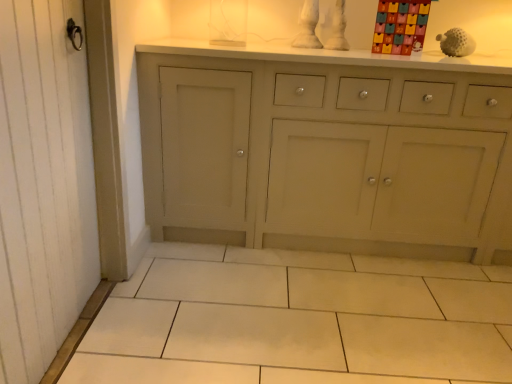
Question: From a real-world perspective, does white matte golf ball at upper right, acting as the 2th toy starting from the left, stand above white wood screen door at left?

Choices:
 (A) no
 (B) yes

Answer: (B)

Question: Considering the relative positions of white matte golf ball at upper right, acting as the 2th toy starting from the left, and white wood screen door at left in the image provided, is white matte golf ball at upper right, acting as the 2th toy starting from the left, to the right of white wood screen door at left from the viewer's perspective?

Choices:
 (A) no
 (B) yes

Answer: (B)

Question: Can you confirm if white matte golf ball at upper right, which is the 1th toy in right-to-left order, is thinner than white wood screen door at left?

Choices:
 (A) yes
 (B) no

Answer: (B)

Question: Does white matte golf ball at upper right, acting as the 2th toy starting from the left, have a greater height compared to white wood screen door at left?

Choices:
 (A) no
 (B) yes

Answer: (A)

Question: From the image's perspective, is white matte golf ball at upper right, which is the 1th toy in right-to-left order, located beneath white wood screen door at left?

Choices:
 (A) no
 (B) yes

Answer: (A)

Question: Is white matte golf ball at upper right, acting as the 2th toy starting from the left, with white wood screen door at left?

Choices:
 (A) no
 (B) yes

Answer: (A)

Question: Is white wood screen door at left outside of white matte golf ball at upper right, which is the 1th toy in right-to-left order?

Choices:
 (A) yes
 (B) no

Answer: (A)

Question: Does white wood screen door at left have a lesser width compared to white matte golf ball at upper right, which is the 1th toy in right-to-left order?

Choices:
 (A) yes
 (B) no

Answer: (A)

Question: Is white wood screen door at left oriented towards white matte golf ball at upper right, acting as the 2th toy starting from the left?

Choices:
 (A) yes
 (B) no

Answer: (B)

Question: From a real-world perspective, is white wood screen door at left positioned under white matte golf ball at upper right, which is the 1th toy in right-to-left order, based on gravity?

Choices:
 (A) yes
 (B) no

Answer: (A)

Question: Does white wood screen door at left have a greater width compared to white matte golf ball at upper right, acting as the 2th toy starting from the left?

Choices:
 (A) yes
 (B) no

Answer: (B)

Question: Can you confirm if white wood screen door at left is positioned to the right of white matte golf ball at upper right, acting as the 2th toy starting from the left?

Choices:
 (A) no
 (B) yes

Answer: (A)

Question: Is multicolored cardboard advent calendar at upper right, marked as the second toy in a right-to-left arrangement, directly adjacent to white matte golf ball at upper right, which is the 1th toy in right-to-left order?

Choices:
 (A) no
 (B) yes

Answer: (A)